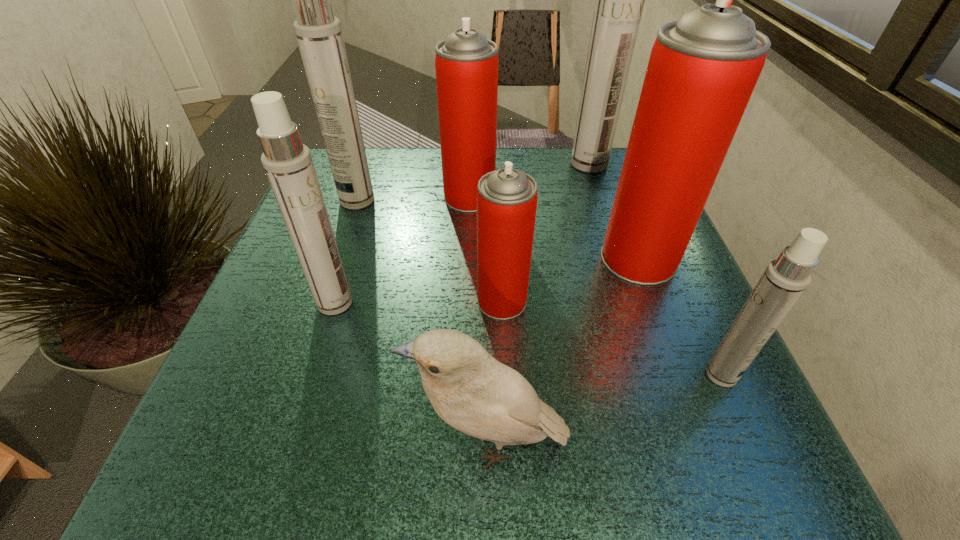
You are a GUI agent. You are given a task and a screenshot of the screen. Output one action in this format:
    pyautogui.click(x=<x>, y=<y>)
    Task: Click on the white aerosol can that is the nearest to the second nearest white aerosol can
    This screenshot has height=540, width=960.
    Given the screenshot: What is the action you would take?
    pyautogui.click(x=319, y=35)

I want to click on the third closest white aerosol can to the third nearest white aerosol can, so coord(784,280).

Identify which red aerosol can is the third closest to the farthest object. Please provide its 2D coordinates. Your answer should be formatted as a tuple, i.e. [(x, y)], where the tuple contains the x and y coordinates of a point satisfying the conditions above.

[(507, 198)]

Identify which red aerosol can is the second closest to the second nearest white aerosol can. Please provide its 2D coordinates. Your answer should be formatted as a tuple, i.e. [(x, y)], where the tuple contains the x and y coordinates of a point satisfying the conditions above.

[(466, 63)]

I want to click on free point that satisfies the following two spatial constraints: 1. on the front side of the third nearest white aerosol can; 2. on the right side of the second nearest object, so click(299, 375).

At what (x,y) coordinates should I click in order to perform the action: click on vacant region that satisfies the following two spatial constraints: 1. on the back side of the farthest red aerosol can; 2. on the right side of the third smallest white aerosol can. Please return your answer as a coordinate pair (x, y). Image resolution: width=960 pixels, height=540 pixels. Looking at the image, I should click on (358, 197).